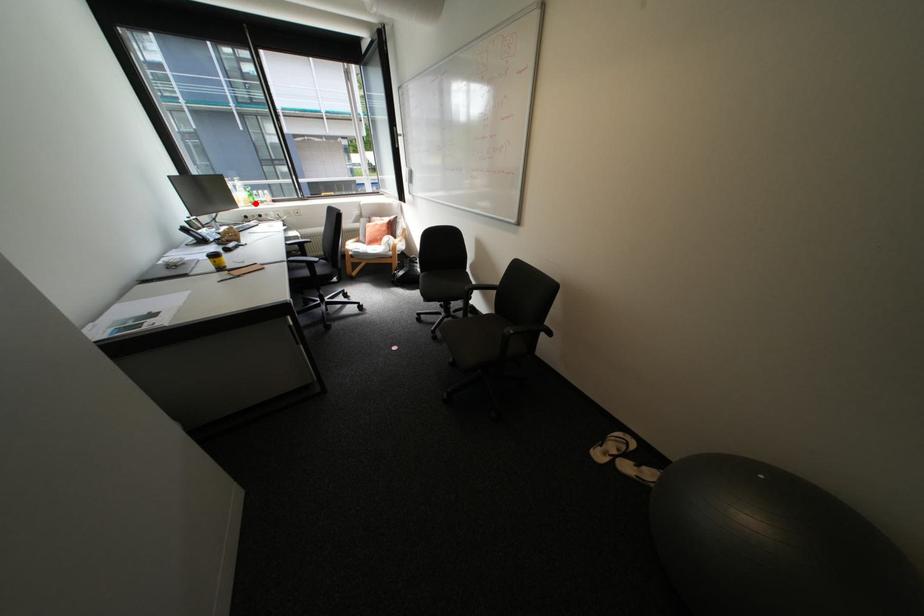
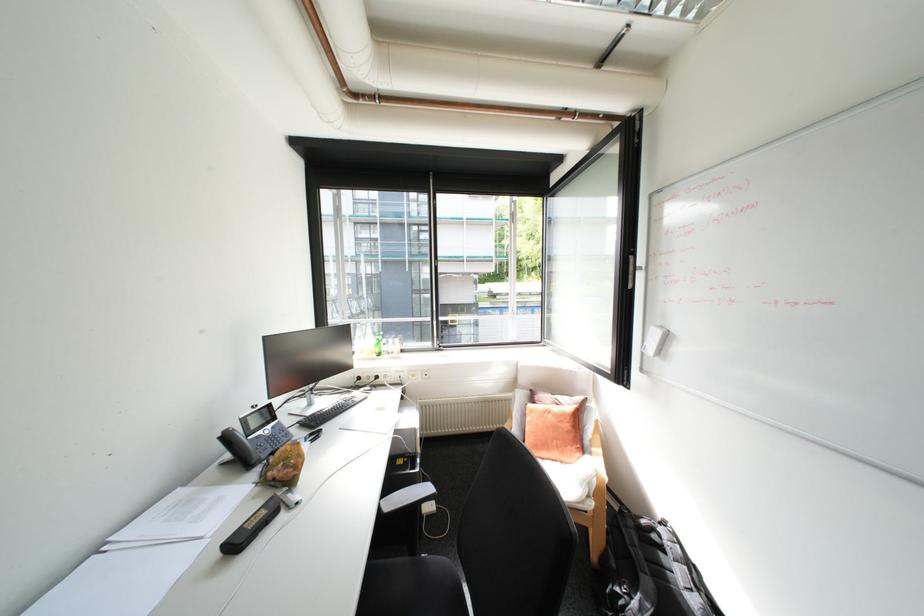
Find the pixel in the second image that matches the highlighted location in the first image.

(379, 354)